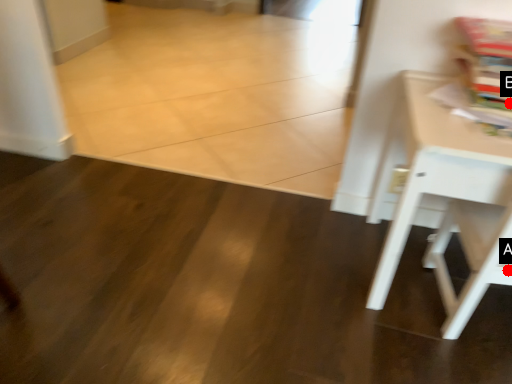
Question: Two points are circled on the image, labeled by A and B beside each circle. Which point is further to the camera?

Choices:
 (A) A is further
 (B) B is further

Answer: (B)